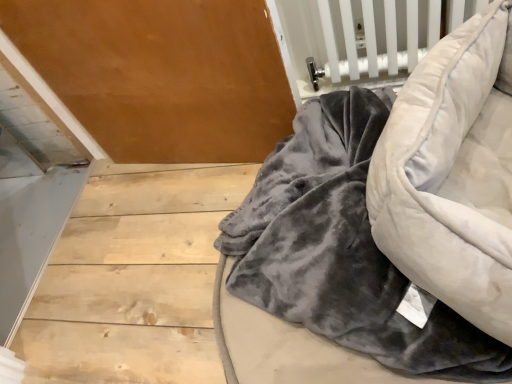
Question: Is velvet gray bean bag chair at lower right closer to camera compared to velvet gray blanket at lower right?

Choices:
 (A) yes
 (B) no

Answer: (A)

Question: Is velvet gray bean bag chair at lower right behind velvet gray blanket at lower right?

Choices:
 (A) no
 (B) yes

Answer: (A)

Question: From the image's perspective, does velvet gray bean bag chair at lower right appear lower than velvet gray blanket at lower right?

Choices:
 (A) no
 (B) yes

Answer: (A)

Question: Is velvet gray bean bag chair at lower right aimed at velvet gray blanket at lower right?

Choices:
 (A) no
 (B) yes

Answer: (A)

Question: Is velvet gray bean bag chair at lower right oriented away from velvet gray blanket at lower right?

Choices:
 (A) no
 (B) yes

Answer: (A)

Question: Is velvet gray bean bag chair at lower right shorter than velvet gray blanket at lower right?

Choices:
 (A) no
 (B) yes

Answer: (A)

Question: Is velvet gray blanket at lower right thinner than velvet gray bean bag chair at lower right?

Choices:
 (A) yes
 (B) no

Answer: (B)

Question: Is velvet gray blanket at lower right closer to camera compared to velvet gray bean bag chair at lower right?

Choices:
 (A) yes
 (B) no

Answer: (B)

Question: Considering the relative sizes of velvet gray blanket at lower right and velvet gray bean bag chair at lower right in the image provided, is velvet gray blanket at lower right taller than velvet gray bean bag chair at lower right?

Choices:
 (A) no
 (B) yes

Answer: (A)

Question: Considering the relative sizes of velvet gray blanket at lower right and velvet gray bean bag chair at lower right in the image provided, is velvet gray blanket at lower right bigger than velvet gray bean bag chair at lower right?

Choices:
 (A) yes
 (B) no

Answer: (A)

Question: Considering the relative positions of velvet gray blanket at lower right and velvet gray bean bag chair at lower right in the image provided, is velvet gray blanket at lower right behind velvet gray bean bag chair at lower right?

Choices:
 (A) yes
 (B) no

Answer: (A)

Question: Does velvet gray blanket at lower right appear on the right side of velvet gray bean bag chair at lower right?

Choices:
 (A) yes
 (B) no

Answer: (B)

Question: Is velvet gray blanket at lower right wider or thinner than velvet gray bean bag chair at lower right?

Choices:
 (A) wide
 (B) thin

Answer: (A)